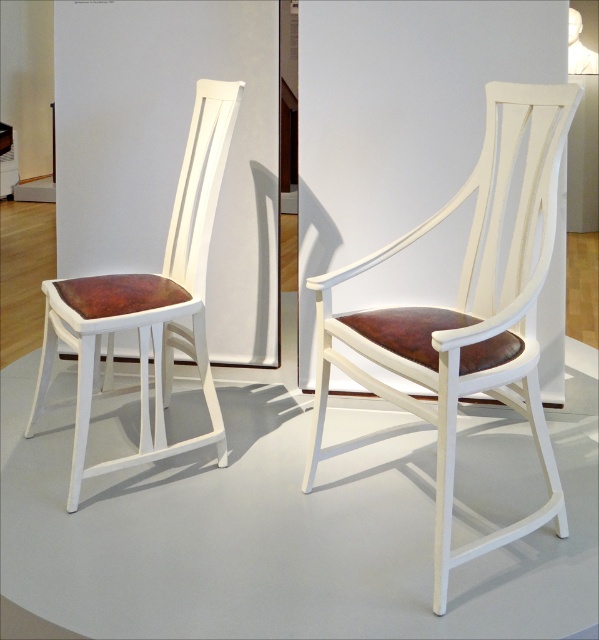
Question: Which of the following is the closest to the observer?

Choices:
 (A) matte white chair at left
 (B) matte white chair at center

Answer: (B)

Question: Is matte white chair at center further to camera compared to matte white chair at left?

Choices:
 (A) yes
 (B) no

Answer: (B)

Question: Which object appears farthest from the camera in this image?

Choices:
 (A) matte white chair at center
 (B) matte white chair at left

Answer: (B)

Question: Does matte white chair at center have a lesser width compared to matte white chair at left?

Choices:
 (A) no
 (B) yes

Answer: (B)

Question: Is matte white chair at center below matte white chair at left?

Choices:
 (A) no
 (B) yes

Answer: (B)